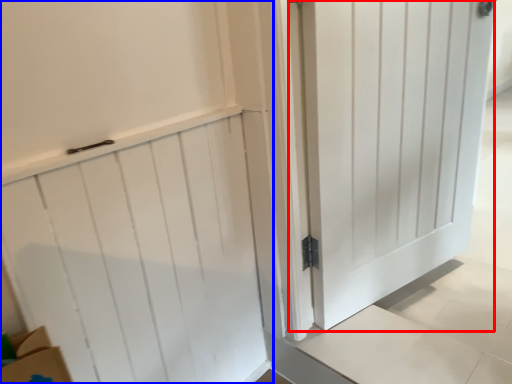
Question: Which point is further to the camera, door (highlighted by a red box) or door (highlighted by a blue box)?

Choices:
 (A) door
 (B) door

Answer: (A)